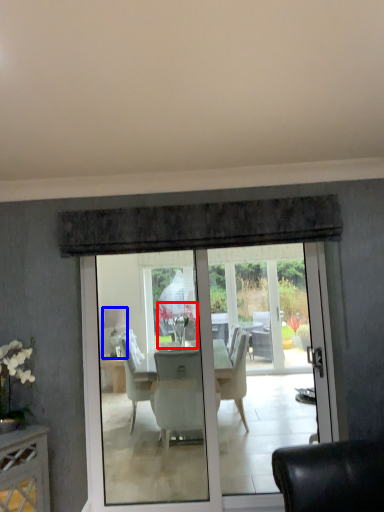
Question: Which of the following is the farthest to the observer, flower (highlighted by a red box) or lamp (highlighted by a blue box)?

Choices:
 (A) flower
 (B) lamp

Answer: (B)